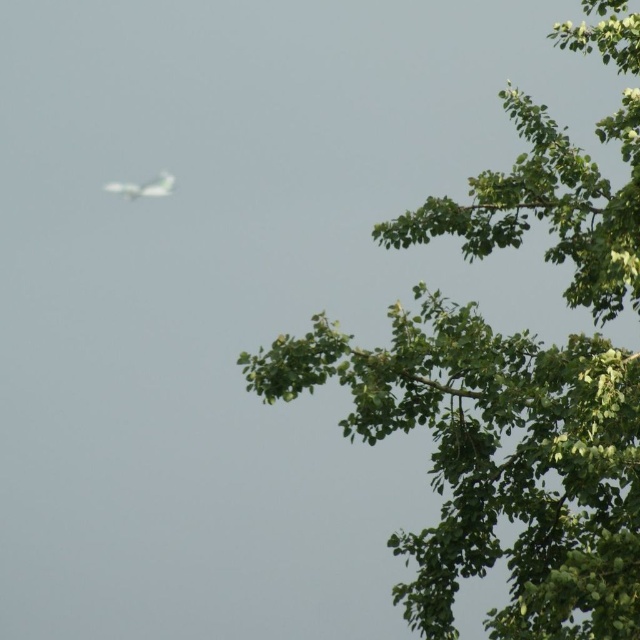
Question: Is green leafy tree at upper right to the right of white matte airplane at upper left from the viewer's perspective?

Choices:
 (A) no
 (B) yes

Answer: (B)

Question: Considering the relative positions of green leafy tree at upper right and white matte airplane at upper left in the image provided, where is green leafy tree at upper right located with respect to white matte airplane at upper left?

Choices:
 (A) right
 (B) left

Answer: (A)

Question: Which object is farther from the camera taking this photo?

Choices:
 (A) white matte airplane at upper left
 (B) green leafy tree at upper right

Answer: (A)

Question: Among these points, which one is nearest to the camera?

Choices:
 (A) (602, 244)
 (B) (150, 188)

Answer: (A)

Question: Does green leafy tree at upper right have a larger size compared to white matte airplane at upper left?

Choices:
 (A) yes
 (B) no

Answer: (A)